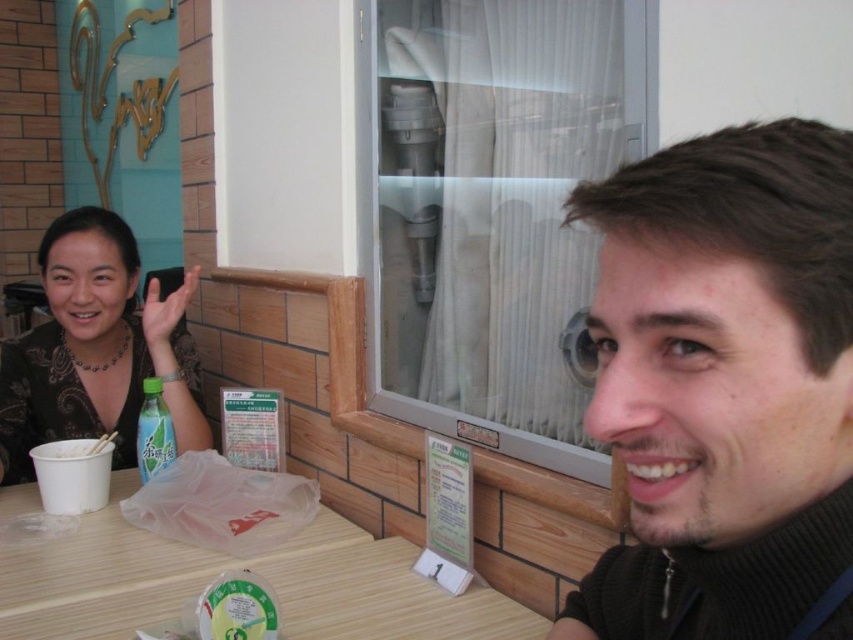
Looking at this image, you are a customer in a restaurant and want to grab the chopsticks from the white disposable cup in front of you. However, there is a hand in the way. Which object is closer to you, the dark brown hair at right or the matte black hand at upper left?

The matte black hand at upper left is closer to you because it is above the dark brown hair at right, meaning the hand is nearer in the scene.

You are a waiter at the restaurant and need to place a new order of drinks on the table. The table has limited space. The dark brown hair at right and the matte black hand at upper left are on the table. Which side should you place the drinks to avoid blocking the customer?

The dark brown hair at right is positioned on the right side of matte black hand at upper left, so placing the drinks on the right side of the dark brown hair at right would avoid blocking the customer.

You are a restaurant server who needs to check if the dark brown hair at right and the matte black hand at upper left can both fit on a 15 cm wide tray. Can you fit both items on the tray?

The dark brown hair at right is narrower than the matte black hand at upper left. Since the total width of both items combined would be less than 15 cm, they can fit on the tray.